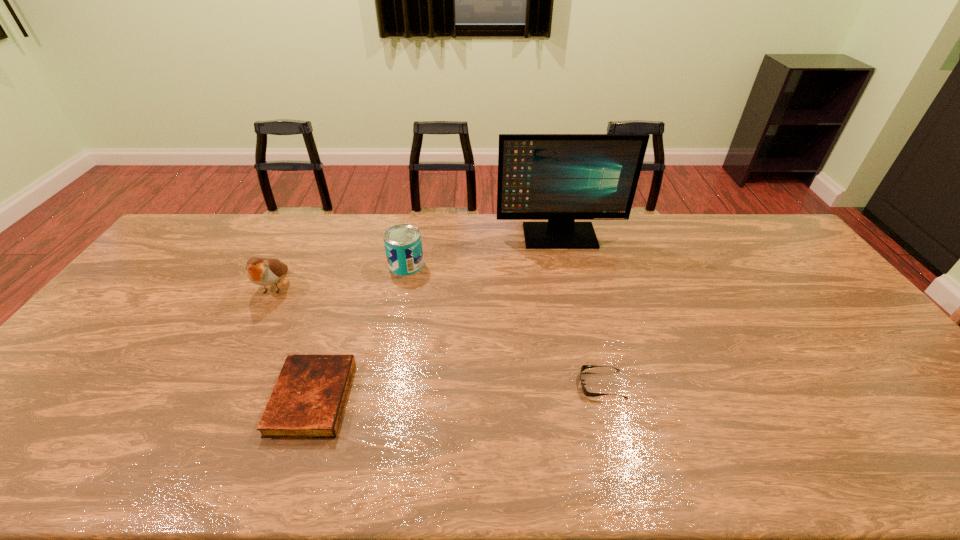
Where is `free point between the third object from left to right and the shortest object`? This screenshot has height=540, width=960. free point between the third object from left to right and the shortest object is located at coordinates (504, 325).

This screenshot has height=540, width=960. Find the location of `object identified as the second closest to the Bible`. object identified as the second closest to the Bible is located at coordinates (403, 245).

Locate which object is the fourth closest to the tallest object. Please provide its 2D coordinates. Your answer should be formatted as a tuple, i.e. [(x, y)], where the tuple contains the x and y coordinates of a point satisfying the conditions above.

[(261, 271)]

Locate an element on the screen. free space that satisfies the following two spatial constraints: 1. on the screen side of the farthest object; 2. on the spine side of the fourth tallest object is located at coordinates 597,398.